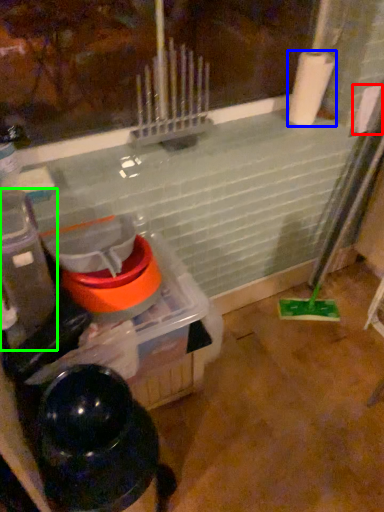
Question: Which object is positioned closest to toilet paper (highlighted by a red box)? Select from paper towel (highlighted by a blue box) and appliance (highlighted by a green box).

Choices:
 (A) paper towel
 (B) appliance

Answer: (A)